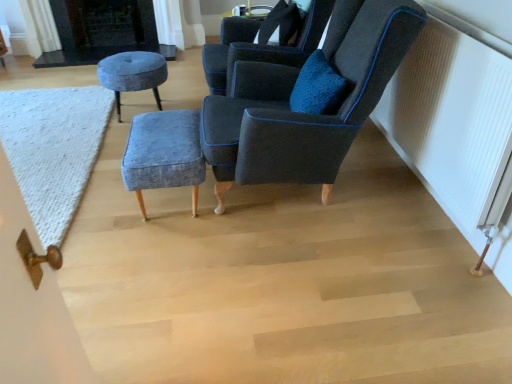
The height and width of the screenshot is (384, 512). Find the location of `velvet dark blue armchair at center, positioned as the second chair in front-to-back order`. velvet dark blue armchair at center, positioned as the second chair in front-to-back order is located at coordinates (260, 46).

Identify the location of white textured radiator at right. The width and height of the screenshot is (512, 384). (455, 129).

Locate an element on the screen. white knitted mat at lower left is located at coordinates (53, 149).

This screenshot has width=512, height=384. What do you see at coordinates (132, 74) in the screenshot? I see `velvet blue stool at center, which is the first stool from top to bottom` at bounding box center [132, 74].

What is the approximate height of velvet blue stool at center, which is the first stool from top to bottom?

It is 15.84 inches.

The image size is (512, 384). Describe the element at coordinates (102, 31) in the screenshot. I see `dark gray stone fireplace at upper left` at that location.

What are the coordinates of `velvet dark blue armchair at center, which is the first chair in back-to-front order` in the screenshot? It's located at (260, 46).

Between velvet dark blue armchair at center, positioned as the second chair in front-to-back order, and denim fabric stool at center, the 1th stool in the right-to-left sequence, which one has larger size?

velvet dark blue armchair at center, positioned as the second chair in front-to-back order, is bigger.

From a real-world perspective, between velvet dark blue armchair at center, positioned as the second chair in front-to-back order, and denim fabric stool at center, arranged as the second stool when viewed from the top, who is vertically lower?

From a 3D spatial view, denim fabric stool at center, arranged as the second stool when viewed from the top, is below.

Can you confirm if velvet dark blue armchair at center, positioned as the second chair in front-to-back order, is positioned to the right of denim fabric stool at center, arranged as the second stool when viewed from the top?

Indeed, velvet dark blue armchair at center, positioned as the second chair in front-to-back order, is positioned on the right side of denim fabric stool at center, arranged as the second stool when viewed from the top.

Considering the sizes of objects white knitted mat at lower left and velvet dark blue chair at upper right, which is counted as the first chair, starting from the front, in the image provided, who is bigger, white knitted mat at lower left or velvet dark blue chair at upper right, which is counted as the first chair, starting from the front,?

With larger size is velvet dark blue chair at upper right, which is counted as the first chair, starting from the front.

From a real-world perspective, does white knitted mat at lower left stand above velvet dark blue chair at upper right, which appears as the second chair when viewed from the back?

No, from a real-world perspective, white knitted mat at lower left is not above velvet dark blue chair at upper right, which appears as the second chair when viewed from the back.

Is white knitted mat at lower left thinner than velvet dark blue chair at upper right, which appears as the second chair when viewed from the back?

No.

From a real-world perspective, count 2nd chairs upward from the white knitted mat at lower left and point to it. Please provide its 2D coordinates.

[(306, 114)]

Considering the sizes of objects velvet dark blue chair at upper right, which is counted as the first chair, starting from the front, and denim fabric stool at center, positioned as the 2th stool in left-to-right order, in the image provided, who is wider, velvet dark blue chair at upper right, which is counted as the first chair, starting from the front, or denim fabric stool at center, positioned as the 2th stool in left-to-right order,?

With larger width is velvet dark blue chair at upper right, which is counted as the first chair, starting from the front.

In the scene shown: Is velvet dark blue chair at upper right, which is counted as the first chair, starting from the front, completely or partially outside of denim fabric stool at center, positioned as the 2th stool in left-to-right order?

Yes.

Is velvet dark blue chair at upper right, which appears as the second chair when viewed from the back, in front of denim fabric stool at center, which ranks as the 1th stool in front-to-back order?

That is True.

Considering the positions of point (391, 42) and point (168, 182), is point (391, 42) closer or farther from the camera than point (168, 182)?

Point (391, 42) is closer to the camera than point (168, 182).

Looking at this image, is velvet dark blue armchair at center, which is the first chair in back-to-front order, facing away from velvet blue stool at center, the 2th stool when ordered from bottom to top?

No.

Looking at their sizes, would you say velvet dark blue armchair at center, positioned as the second chair in front-to-back order, is wider or thinner than velvet blue stool at center, the 1th stool when ordered from left to right?

velvet dark blue armchair at center, positioned as the second chair in front-to-back order, is wider than velvet blue stool at center, the 1th stool when ordered from left to right.

Which of these two, velvet dark blue armchair at center, positioned as the second chair in front-to-back order, or velvet blue stool at center, the first stool from the back, is bigger?

velvet dark blue armchair at center, positioned as the second chair in front-to-back order, is bigger.

Which is correct: denim fabric stool at center, placed as the first stool when sorted from bottom to top, is inside velvet blue stool at center, which is the 2th stool in right-to-left order, or outside of it?

denim fabric stool at center, placed as the first stool when sorted from bottom to top, is not inside velvet blue stool at center, which is the 2th stool in right-to-left order, it's outside.

What are the coordinates of `stool on the right side of velvet blue stool at center, which is the first stool from top to bottom` in the screenshot? It's located at (164, 154).

Between denim fabric stool at center, placed as the first stool when sorted from bottom to top, and velvet blue stool at center, which is the 2th stool in right-to-left order, which one appears on the left side from the viewer's perspective?

velvet blue stool at center, which is the 2th stool in right-to-left order.

From the image's perspective, is denim fabric stool at center, arranged as the second stool when viewed from the top, above or below velvet blue stool at center, placed as the second stool when sorted from front to back?

Clearly, from the image's perspective, denim fabric stool at center, arranged as the second stool when viewed from the top, is below velvet blue stool at center, placed as the second stool when sorted from front to back.

Would you say white knitted mat at lower left is to the left or to the right of velvet dark blue armchair at center, positioned as the second chair in front-to-back order, in the picture?

From the image, it's evident that white knitted mat at lower left is to the left of velvet dark blue armchair at center, positioned as the second chair in front-to-back order.

Image resolution: width=512 pixels, height=384 pixels. Find the location of `mat that is below the velvet dark blue armchair at center, positioned as the second chair in front-to-back order (from the image's perspective)`. mat that is below the velvet dark blue armchair at center, positioned as the second chair in front-to-back order (from the image's perspective) is located at coordinates (53, 149).

Does point (5, 152) come farther from viewer compared to point (252, 41)?

No, (5, 152) is in front of (252, 41).

Is white knitted mat at lower left outside of velvet dark blue armchair at center, positioned as the second chair in front-to-back order?

Yes, white knitted mat at lower left is outside of velvet dark blue armchair at center, positioned as the second chair in front-to-back order.

Is dark gray stone fireplace at upper left thinner than velvet dark blue armchair at center, positioned as the second chair in front-to-back order?

Yes.

Consider the image. Is dark gray stone fireplace at upper left situated inside velvet dark blue armchair at center, positioned as the second chair in front-to-back order, or outside?

dark gray stone fireplace at upper left is outside velvet dark blue armchair at center, positioned as the second chair in front-to-back order.

From a real-world perspective, which stool is the 2nd one underneath the velvet dark blue armchair at center, which is the first chair in back-to-front order? Please provide its 2D coordinates.

[(164, 154)]

The width and height of the screenshot is (512, 384). Identify the location of mat behind the velvet dark blue chair at upper right, which is counted as the first chair, starting from the front. point(53,149).

When comparing their distances from dark gray stone fireplace at upper left, does velvet dark blue chair at upper right, which appears as the second chair when viewed from the back, or denim fabric stool at center, the 2th stool when ordered from back to front, seem closer?

The object closer to dark gray stone fireplace at upper left is denim fabric stool at center, the 2th stool when ordered from back to front.

Which object lies nearer to the anchor point white knitted mat at lower left, white textured radiator at right or velvet dark blue chair at upper right, which appears as the second chair when viewed from the back?

velvet dark blue chair at upper right, which appears as the second chair when viewed from the back.

In the scene shown: Based on their spatial positions, is dark gray stone fireplace at upper left or white knitted mat at lower left closer to velvet blue stool at center, which is the first stool from top to bottom?

Among the two, white knitted mat at lower left is located nearer to velvet blue stool at center, which is the first stool from top to bottom.

Looking at the image, which one is located further to white textured radiator at right, white knitted mat at lower left or dark gray stone fireplace at upper left?

Based on the image, dark gray stone fireplace at upper left appears to be further to white textured radiator at right.

From the image, which object appears to be nearer to velvet dark blue chair at upper right, which appears as the second chair when viewed from the back, velvet dark blue armchair at center, positioned as the second chair in front-to-back order, or white textured radiator at right?

The object closer to velvet dark blue chair at upper right, which appears as the second chair when viewed from the back, is velvet dark blue armchair at center, positioned as the second chair in front-to-back order.

From the image, which object appears to be nearer to denim fabric stool at center, positioned as the 2th stool in left-to-right order, white knitted mat at lower left or velvet blue stool at center, which is the 2th stool in right-to-left order?

The object closer to denim fabric stool at center, positioned as the 2th stool in left-to-right order, is white knitted mat at lower left.

Estimate the real-world distances between objects in this image. Which object is further from white textured radiator at right, velvet dark blue armchair at center, positioned as the second chair in front-to-back order, or denim fabric stool at center, positioned as the 2th stool in left-to-right order?

Among the two, denim fabric stool at center, positioned as the 2th stool in left-to-right order, is located further to white textured radiator at right.

Considering their positions, is velvet dark blue armchair at center, which is the first chair in back-to-front order, positioned closer to white textured radiator at right than velvet dark blue chair at upper right, which appears as the second chair when viewed from the back?

velvet dark blue chair at upper right, which appears as the second chair when viewed from the back.

The height and width of the screenshot is (384, 512). What are the coordinates of `mat located between velvet dark blue chair at upper right, which is counted as the first chair, starting from the front, and dark gray stone fireplace at upper left in the depth direction` in the screenshot? It's located at (53, 149).

Locate an element on the screen. This screenshot has width=512, height=384. chair between white textured radiator at right and velvet dark blue armchair at center, which is the first chair in back-to-front order, along the z-axis is located at coordinates (306, 114).

At what (x,y) coordinates should I click in order to perform the action: click on chair located between white knitted mat at lower left and dark gray stone fireplace at upper left in the depth direction. Please return your answer as a coordinate pair (x, y). The height and width of the screenshot is (384, 512). Looking at the image, I should click on (260, 46).

The width and height of the screenshot is (512, 384). I want to click on stool positioned between white knitted mat at lower left and velvet blue stool at center, placed as the second stool when sorted from front to back, from near to far, so click(x=164, y=154).